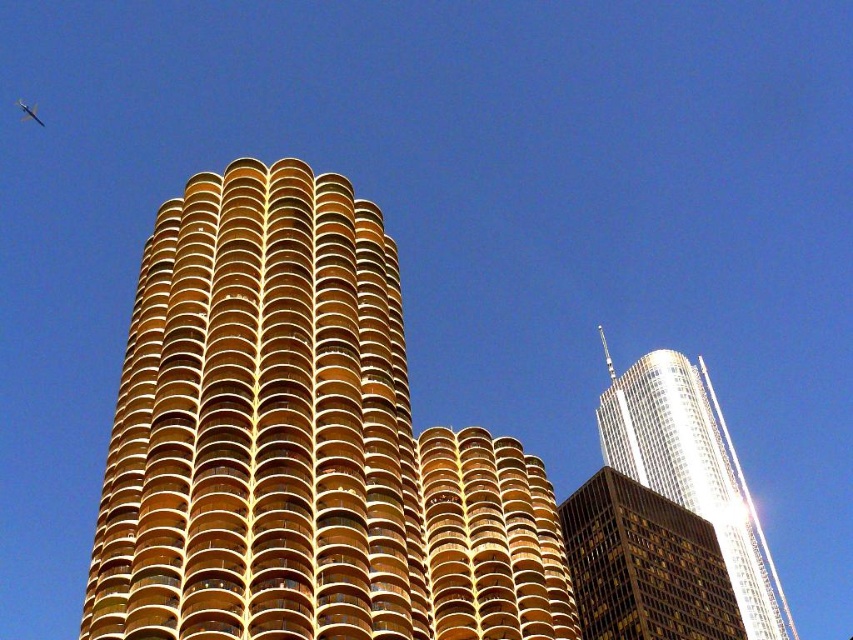
Who is more distant from viewer, (181, 326) or (33, 106)?

The point (33, 106) is more distant.

Image resolution: width=853 pixels, height=640 pixels. What are the coordinates of `gold glassy building at center` in the screenshot? It's located at (299, 444).

Based on the photo, between shiny silver skyscraper at right and metallic silver airplane at upper center, which one appears on the left side from the viewer's perspective?

metallic silver airplane at upper center is more to the left.

Consider the image. Is shiny silver skyscraper at right closer to the viewer compared to metallic silver airplane at upper center?

Yes, it is in front of metallic silver airplane at upper center.

Is point (695, 371) positioned after point (21, 100)?

No.

The height and width of the screenshot is (640, 853). Find the location of `shiny silver skyscraper at right`. shiny silver skyscraper at right is located at coordinates (692, 470).

Is point (659, 538) positioned before point (39, 122)?

Yes, it is in front of point (39, 122).

Which is more to the left, gold reflective glass skyscraper at center or metallic silver airplane at upper center?

metallic silver airplane at upper center

I want to click on gold reflective glass skyscraper at center, so click(x=643, y=564).

At what (x,y) coordinates should I click in order to perform the action: click on gold reflective glass skyscraper at center. Please return your answer as a coordinate pair (x, y). The height and width of the screenshot is (640, 853). Looking at the image, I should click on (643, 564).